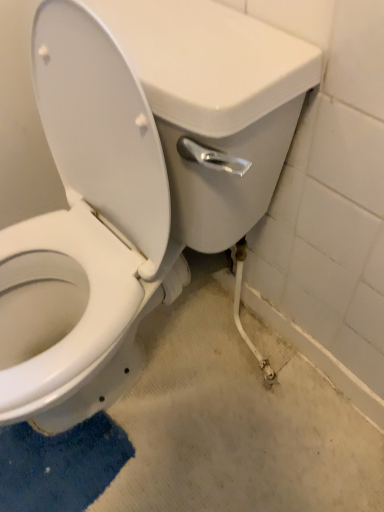
The width and height of the screenshot is (384, 512). Identify the location of white glossy toilet at center. (136, 183).

This screenshot has width=384, height=512. What do you see at coordinates (136, 183) in the screenshot?
I see `white glossy toilet at center` at bounding box center [136, 183].

Where is `white glossy toilet at center`? Image resolution: width=384 pixels, height=512 pixels. white glossy toilet at center is located at coordinates (136, 183).